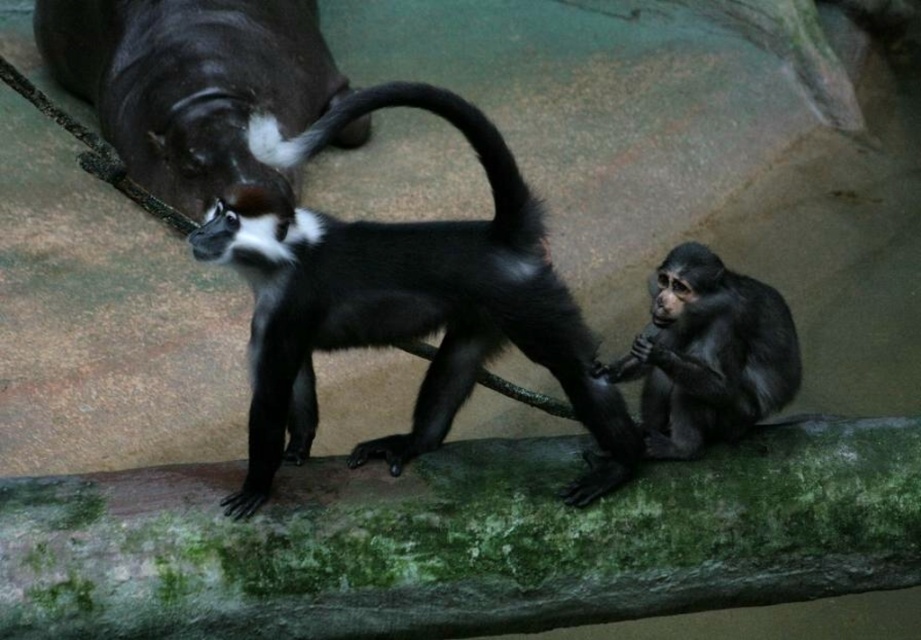
Who is higher up, shiny black monkey at upper left or shiny black monkey at center?

shiny black monkey at upper left is above.

Based on the photo, between shiny black monkey at upper left and shiny black monkey at center, which one appears on the left side from the viewer's perspective?

From the viewer's perspective, shiny black monkey at upper left appears more on the left side.

Between point (194, 192) and point (697, 396), which one is positioned in front?

Positioned in front is point (697, 396).

Image resolution: width=921 pixels, height=640 pixels. Identify the location of shiny black monkey at upper left. [191, 83].

Between shiny black monkey at upper left and black glossy tail at center, which one is positioned lower?

Positioned lower is black glossy tail at center.

Based on the photo, does shiny black monkey at upper left have a greater height compared to black glossy tail at center?

Indeed, shiny black monkey at upper left has a greater height compared to black glossy tail at center.

Who is more distant from viewer, (82, 12) or (410, 99)?

The point (82, 12) is more distant.

Locate an element on the screen. Image resolution: width=921 pixels, height=640 pixels. shiny black monkey at upper left is located at coordinates (191, 83).

Does shiny black monkey at center have a larger size compared to black glossy tail at center?

No.

Is point (710, 401) farther from viewer compared to point (467, 132)?

Yes.

At what (x,y) coordinates should I click in order to perform the action: click on shiny black monkey at center. Please return your answer as a coordinate pair (x, y). Image resolution: width=921 pixels, height=640 pixels. Looking at the image, I should click on (708, 355).